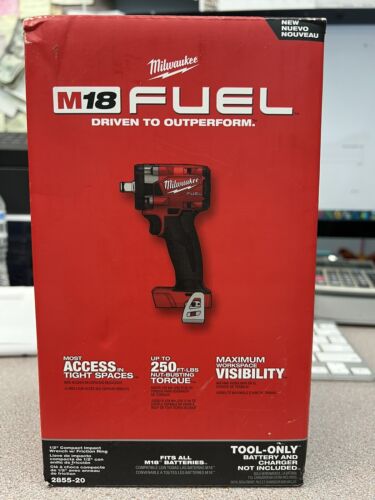
Identify the location of notes. (31, 5), (5, 9), (8, 25), (18, 122).